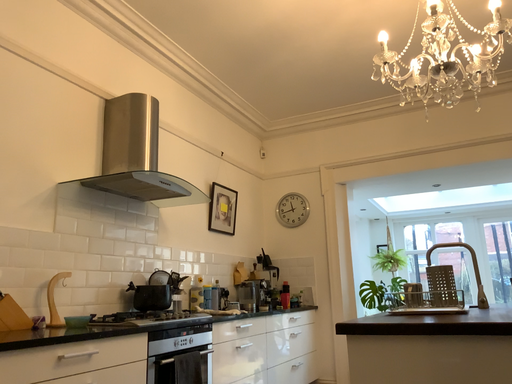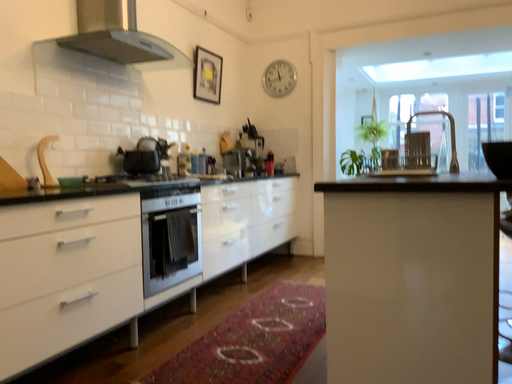
Question: How did the camera likely rotate when shooting the video?

Choices:
 (A) rotated downward
 (B) rotated upward

Answer: (A)